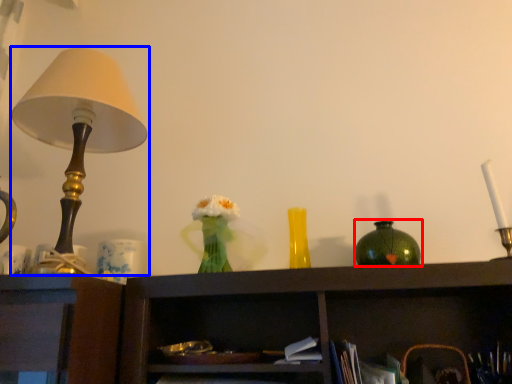
Question: Which object appears farthest to the camera in this image, vase (highlighted by a red box) or lamp (highlighted by a blue box)?

Choices:
 (A) vase
 (B) lamp

Answer: (A)